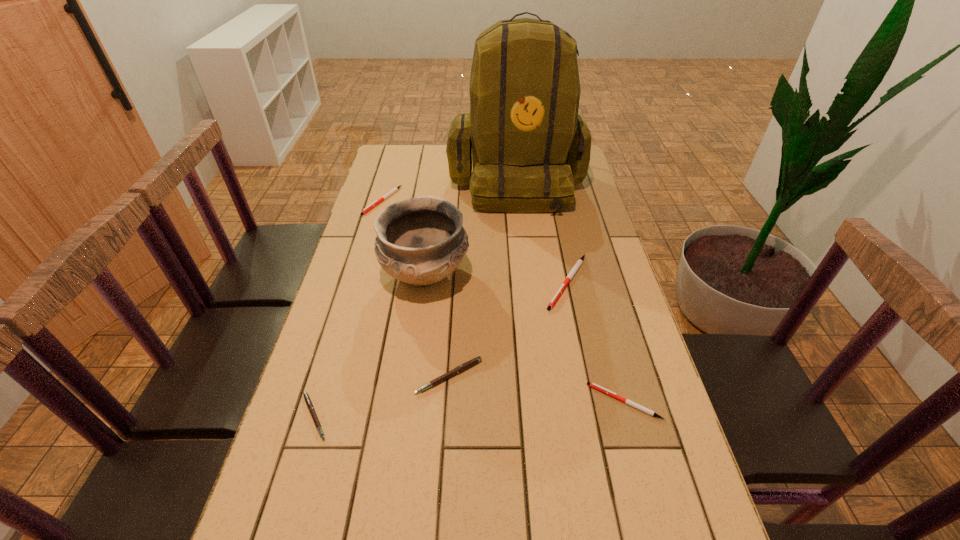
At what (x,y) coordinates should I click in order to perform the action: click on backpack. Please return your answer as a coordinate pair (x, y). This screenshot has width=960, height=540. Looking at the image, I should click on (529, 147).

I want to click on pottery, so click(420, 240).

At what (x,y) coordinates should I click in order to perform the action: click on the biggest white pen. Please return your answer as a coordinate pair (x, y). Looking at the image, I should click on (580, 261).

In order to click on the second nearest white pen in this screenshot , I will do `click(580, 261)`.

Locate an element on the screen. the bigger pink pen is located at coordinates (470, 363).

Where is `the right pink pen`? This screenshot has width=960, height=540. the right pink pen is located at coordinates (470, 363).

At what (x,y) coordinates should I click in order to perform the action: click on the second smallest white pen. Please return your answer as a coordinate pair (x, y). Looking at the image, I should click on (395, 189).

I want to click on the farthest white pen, so click(x=395, y=189).

Identify the location of the smaller pink pen. This screenshot has height=540, width=960. (308, 401).

This screenshot has width=960, height=540. Find the location of `the smallest white pen`. the smallest white pen is located at coordinates (593, 385).